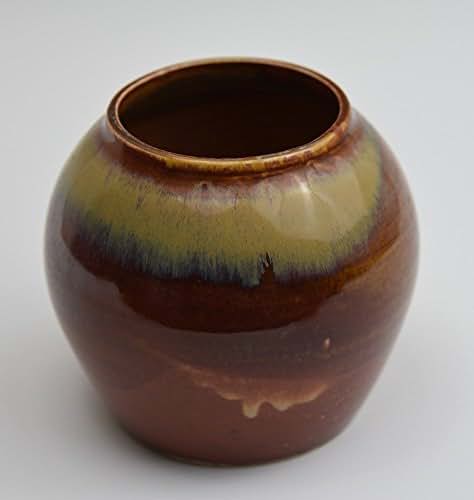
The width and height of the screenshot is (474, 500). In order to click on gray background color in this screenshot , I will do `click(400, 39)`.